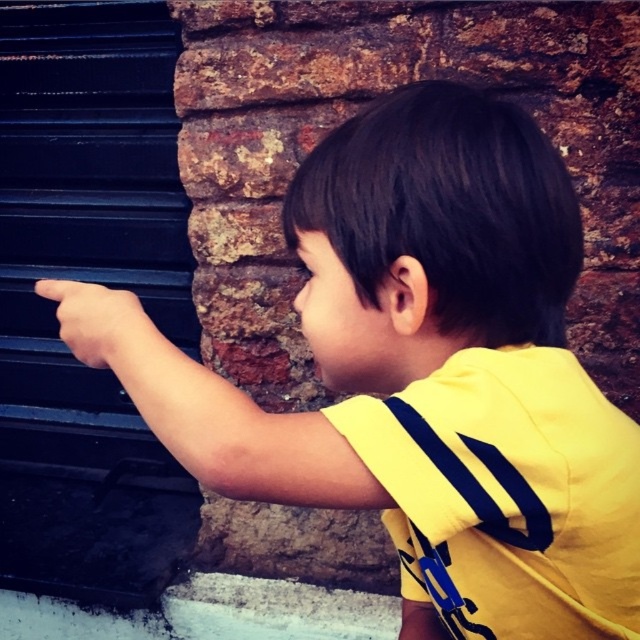
You are a painter who needs to paint both the black matte garage door at left and the smooth skin hand at left. If you have enough paint to cover 10 square feet, which object requires more paint and why?

The black matte garage door at left requires more paint because its width is larger than the smooth skin hand at left, meaning it has a greater surface area to cover.

Consider the image. You are a painter who needs to paint both the black matte garage door at left and the smooth skin hand at left. Which object requires more paint because it has a bigger surface area?

The black matte garage door at left requires more paint because it is larger in size than the smooth skin hand at left.